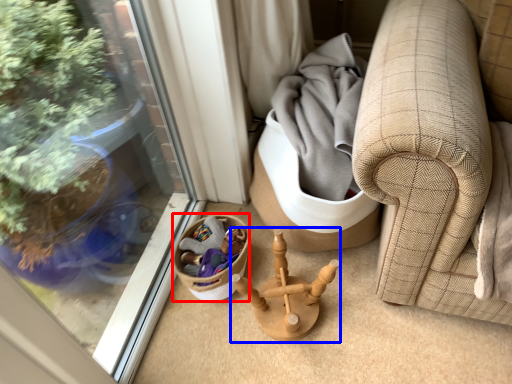
Question: Which object is closer to the camera taking this photo, basket (highlighted by a red box) or miniature (highlighted by a blue box)?

Choices:
 (A) basket
 (B) miniature

Answer: (B)